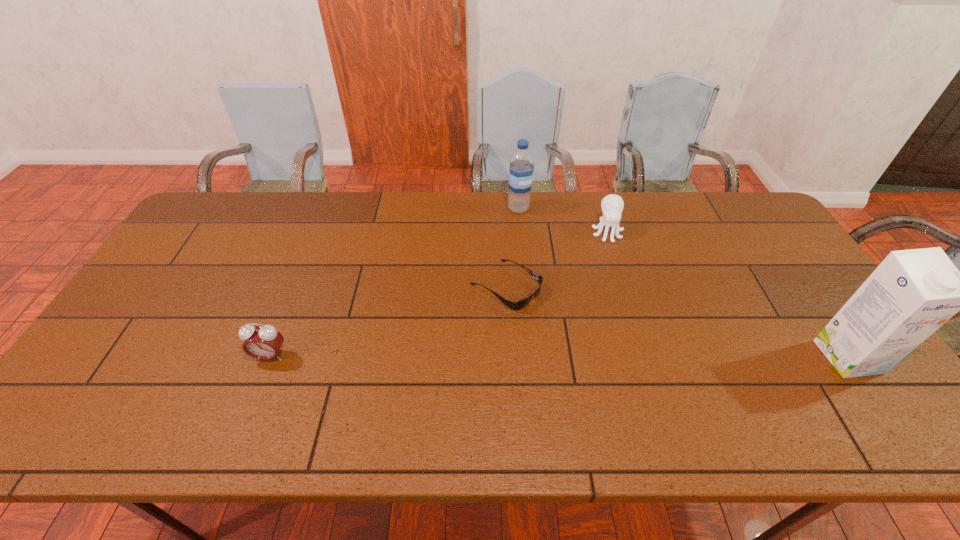
Locate an element on the screen. vacant space on the desktop that is between the alarm clock and the rightmost object and is positioned on the label of the fourth shortest object is located at coordinates (588, 356).

Locate an element on the screen. vacant space on the desktop that is between the leftmost object and the carton and is positioned on the front-facing side of the octopus is located at coordinates (617, 356).

Find the location of `vacant space on the desktop that is between the leftmost object and the carton and is positioned on the front-facing side of the third nearest object`. vacant space on the desktop that is between the leftmost object and the carton and is positioned on the front-facing side of the third nearest object is located at coordinates (613, 356).